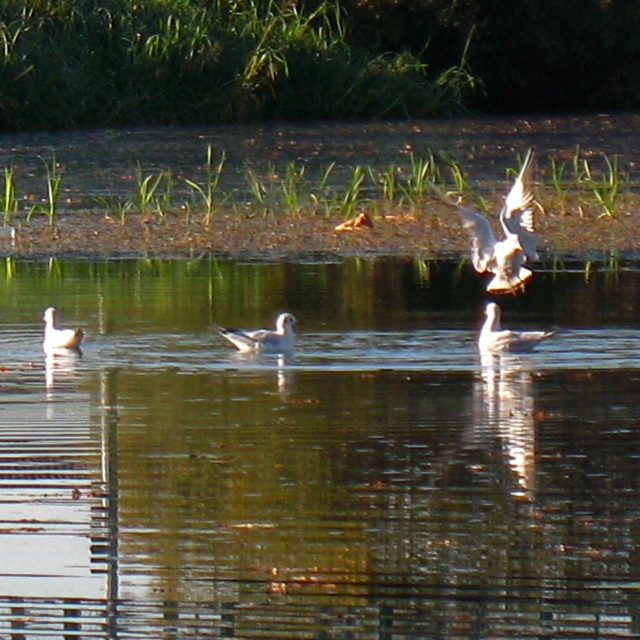
In the scene shown: You are a birdwatcher observing the scene. You notice two birds in the image. Which of the two birds, the white feathered bird at upper right or the white matte seagull at center, is bigger?

The white feathered bird at upper right is larger in size than the white matte seagull at center.

You are standing at the edge of the pond and want to take a photo of both the point at coordinates point (518, 198) and point (250, 340). Which point will appear larger in your photo?

Point (518, 198) is closer to the camera than point (250, 340), so it will appear larger in the photo.

You are a photographer aiming to capture the reflection of the white matte seagull at center in the clear water at center. Based on the scene description, will the reflection be visible?

Yes, the reflection of the white matte seagull at center will be visible because the clear water at center is positioned under it, and the water surface is described as calm with gentle ripples, which allows for clear reflections.